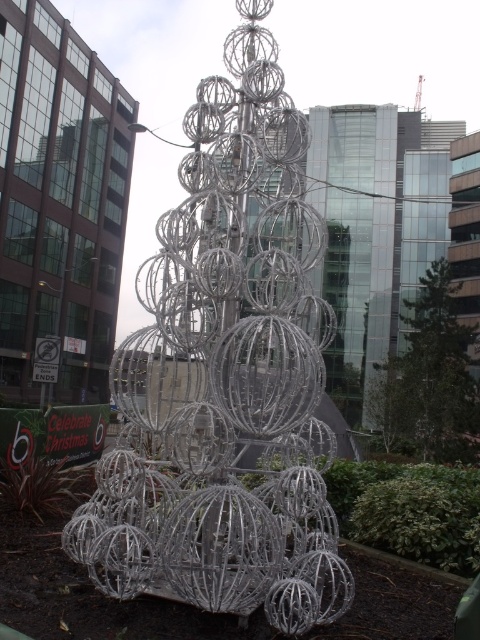
Question: Considering the relative positions of metallic wire sculpture at center and clear glass tree at center in the image provided, where is metallic wire sculpture at center located with respect to clear glass tree at center?

Choices:
 (A) above
 (B) below

Answer: (A)

Question: Which point is closer to the camera?

Choices:
 (A) clear glass tree at center
 (B) metallic wire sculpture at center

Answer: (B)

Question: Among these points, which one is nearest to the camera?

Choices:
 (A) (389, 404)
 (B) (283, 490)

Answer: (B)

Question: Which of the following is the closest to the observer?

Choices:
 (A) (263, 563)
 (B) (400, 442)

Answer: (A)

Question: From the image, what is the correct spatial relationship of metallic wire sculpture at center in relation to clear glass tree at center?

Choices:
 (A) right
 (B) left

Answer: (B)

Question: Can you confirm if metallic wire sculpture at center is smaller than clear glass tree at center?

Choices:
 (A) yes
 (B) no

Answer: (A)